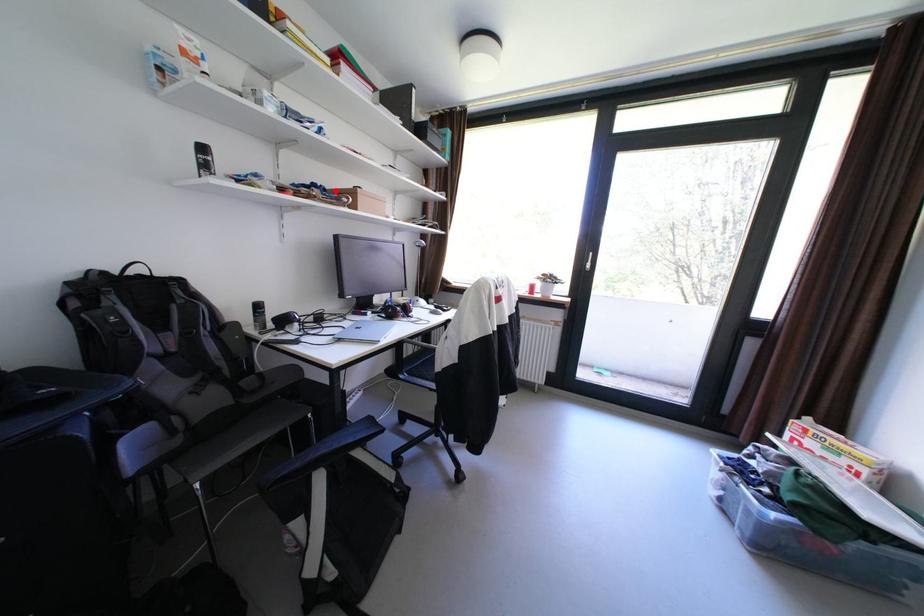
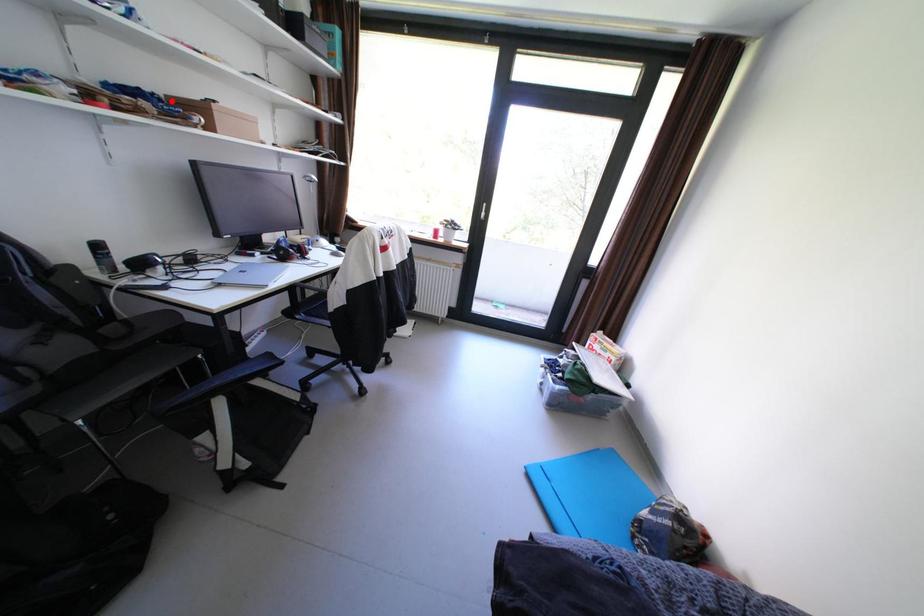
I am providing you with two images of the same scene from different viewpoints. A red point is marked on the first image and another point is marked on the second image. Is the red point in image1 aligned with the point shown in image2?

Yes